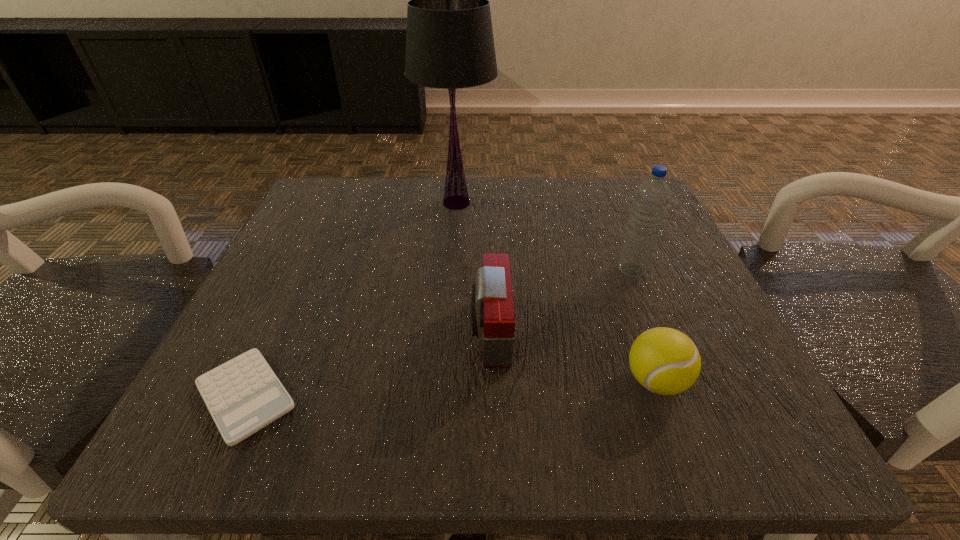
Identify the location of vacant point located between the water bottle and the leftmost object. This screenshot has width=960, height=540. (439, 333).

The image size is (960, 540). Identify the location of vacant area that lies between the shortest object and the water bottle. (439, 333).

Where is `empty space between the farthest object and the third shortest object`? The width and height of the screenshot is (960, 540). empty space between the farthest object and the third shortest object is located at coordinates (473, 267).

At what (x,y) coordinates should I click in order to perform the action: click on vacant space in between the shortest object and the second shortest object. Please return your answer as a coordinate pair (x, y). Looking at the image, I should click on (450, 388).

You are a GUI agent. You are given a task and a screenshot of the screen. Output one action in this format:
    pyautogui.click(x=<x>, y=<y>)
    Task: Click on the vacant space that is in between the leftmost object and the water bottle
    The height and width of the screenshot is (540, 960).
    Given the screenshot: What is the action you would take?
    pyautogui.click(x=439, y=333)

The image size is (960, 540). I want to click on vacant space that is in between the fourth shortest object and the fourth tallest object, so click(x=644, y=325).

The image size is (960, 540). Find the location of `vacant area that lies between the fourth nearest object and the shortest object`. vacant area that lies between the fourth nearest object and the shortest object is located at coordinates (439, 333).

Where is `free spot between the second shortest object and the farthest object`? This screenshot has height=540, width=960. free spot between the second shortest object and the farthest object is located at coordinates (556, 292).

Locate an element on the screen. The image size is (960, 540). vacant space that is in between the farthest object and the tennis ball is located at coordinates (556, 292).

Locate an element on the screen. vacant area between the third tallest object and the second shortest object is located at coordinates (572, 356).